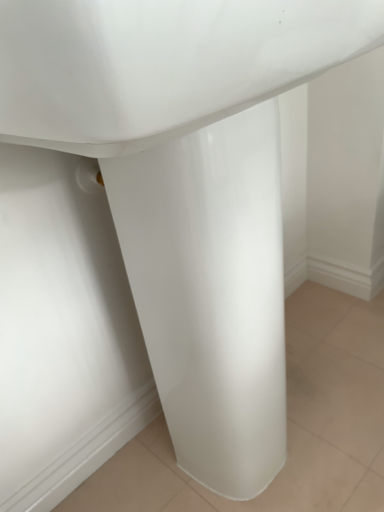
This screenshot has height=512, width=384. What do you see at coordinates (288, 425) in the screenshot?
I see `white glossy tile at center` at bounding box center [288, 425].

Locate an element on the screen. Image resolution: width=384 pixels, height=512 pixels. white glossy tile at center is located at coordinates (288, 425).

Where is `white glossy tile at center`? white glossy tile at center is located at coordinates (288, 425).